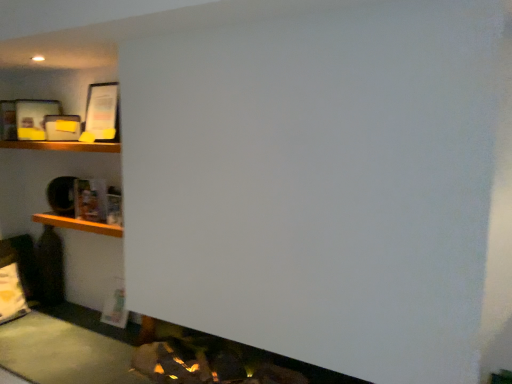
Where is `wooden shelf at upper left`? wooden shelf at upper left is located at coordinates (63, 146).

Describe the element at coordinates (63, 146) in the screenshot. I see `wooden shelf at upper left` at that location.

Where is `wooden shelf at left`? This screenshot has width=512, height=384. wooden shelf at left is located at coordinates (78, 224).

In order to face wooden shelf at left, should I rotate leftwards or rightwards?

Turn left by 21.309 degrees to look at wooden shelf at left.

What do you see at coordinates (78, 224) in the screenshot?
I see `wooden shelf at left` at bounding box center [78, 224].

Identify the location of wooden shelf at upper left. The image size is (512, 384). (63, 146).

Which object is positioned more to the right, wooden shelf at upper left or wooden shelf at left?

Positioned to the right is wooden shelf at left.

Which object is further away from the camera, wooden shelf at upper left or wooden shelf at left?

wooden shelf at left is more distant.

Considering the positions of points (56, 148) and (97, 233), is point (56, 148) closer to camera compared to point (97, 233)?

No, (56, 148) is further to viewer.

From the image's perspective, between wooden shelf at upper left and wooden shelf at left, which one is located above?

wooden shelf at upper left is shown above in the image.

From a real-world perspective, is wooden shelf at upper left on wooden shelf at left?

Indeed, from a real-world perspective, wooden shelf at upper left stands above wooden shelf at left.

Can you confirm if wooden shelf at upper left is wider than wooden shelf at left?

Correct, the width of wooden shelf at upper left exceeds that of wooden shelf at left.

Is wooden shelf at upper left taller than wooden shelf at left?

No.

Considering the relative sizes of wooden shelf at upper left and wooden shelf at left in the image provided, is wooden shelf at upper left bigger than wooden shelf at left?

Correct, wooden shelf at upper left is larger in size than wooden shelf at left.

Would you say wooden shelf at left is part of wooden shelf at upper left's contents?

Actually, wooden shelf at left is outside wooden shelf at upper left.

Is wooden shelf at upper left positioned far away from wooden shelf at left?

That's not correct — wooden shelf at upper left is a little close to wooden shelf at left.

Is wooden shelf at upper left oriented away from wooden shelf at left?

No.

At what (x,y) coordinates should I click in order to perform the action: click on shelf above the wooden shelf at left (from a real-world perspective). Please return your answer as a coordinate pair (x, y). This screenshot has width=512, height=384. Looking at the image, I should click on (63, 146).

Which is more to the left, wooden shelf at left or wooden shelf at upper left?

From the viewer's perspective, wooden shelf at upper left appears more on the left side.

Relative to wooden shelf at upper left, is wooden shelf at left in front or behind?

Visually, wooden shelf at left is located behind wooden shelf at upper left.

Between point (82, 224) and point (14, 143), which one is positioned in front?

The point (82, 224) is closer.

From the image's perspective, which object appears higher, wooden shelf at left or wooden shelf at upper left?

From the image's view, wooden shelf at upper left is above.

From a real-world perspective, who is located higher, wooden shelf at left or wooden shelf at upper left?

wooden shelf at upper left is physically above.

Considering the relative sizes of wooden shelf at left and wooden shelf at upper left in the image provided, is wooden shelf at left thinner than wooden shelf at upper left?

Correct, the width of wooden shelf at left is less than that of wooden shelf at upper left.

Who is shorter, wooden shelf at left or wooden shelf at upper left?

wooden shelf at upper left.

Does wooden shelf at left have a larger size compared to wooden shelf at upper left?

No, wooden shelf at left is not bigger than wooden shelf at upper left.

Can wooden shelf at upper left be found inside wooden shelf at left?

No, wooden shelf at upper left is not surrounded by wooden shelf at left.

From the picture: Is wooden shelf at left not near wooden shelf at upper left?

That's not correct — wooden shelf at left is a little close to wooden shelf at upper left.

Is wooden shelf at left oriented towards wooden shelf at upper left?

No, wooden shelf at left is not aimed at wooden shelf at upper left.

Measure the distance from wooden shelf at left to wooden shelf at upper left.

wooden shelf at left is 55.79 centimeters away from wooden shelf at upper left.

Where is `cabinet behind the wooden shelf at upper left`? cabinet behind the wooden shelf at upper left is located at coordinates (78, 224).

At what (x,y) coordinates should I click in order to perform the action: click on cabinet behind the wooden shelf at upper left. Please return your answer as a coordinate pair (x, y). This screenshot has height=384, width=512. Looking at the image, I should click on (78, 224).

I want to click on cabinet on the right of wooden shelf at upper left, so click(78, 224).